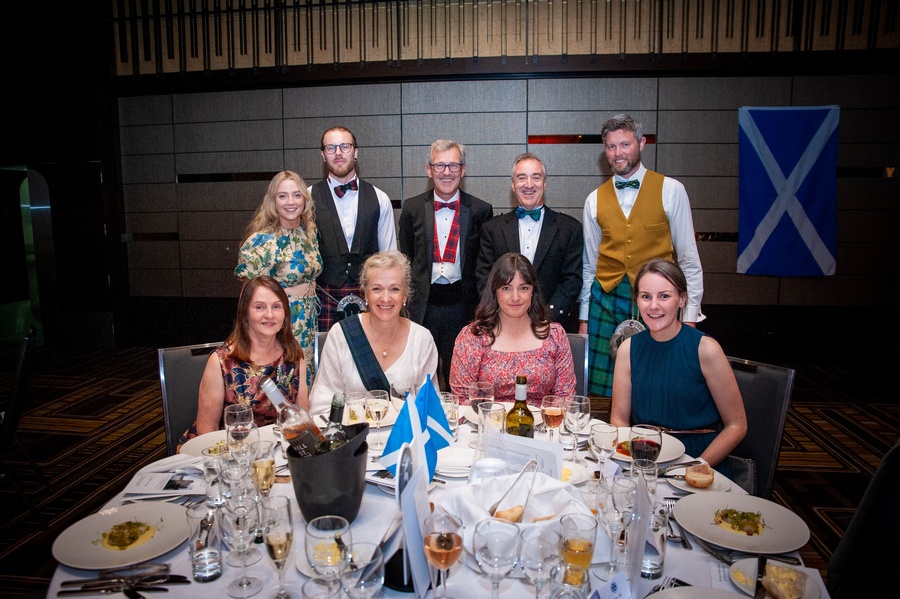
At what (x,y) coordinates should I click in order to perform the action: click on shelves in the background. Please return your answer as a coordinate pair (x, y). Looking at the image, I should click on (475, 119).